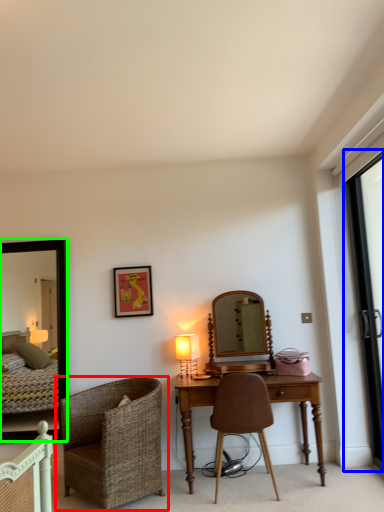
Question: Which object is positioned closest to chair (highlighted by a red box)? Select from screen door (highlighted by a blue box) and mirror (highlighted by a green box).

Choices:
 (A) screen door
 (B) mirror

Answer: (B)